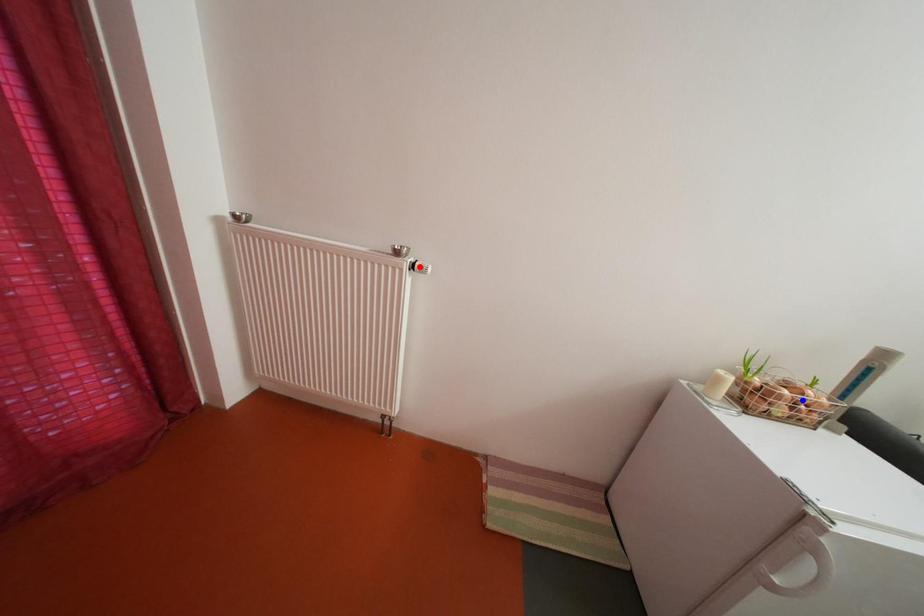
Question: Two points are marked on the image. Which point is closer to the camera?

Choices:
 (A) Blue point is closer.
 (B) Red point is closer.

Answer: (A)